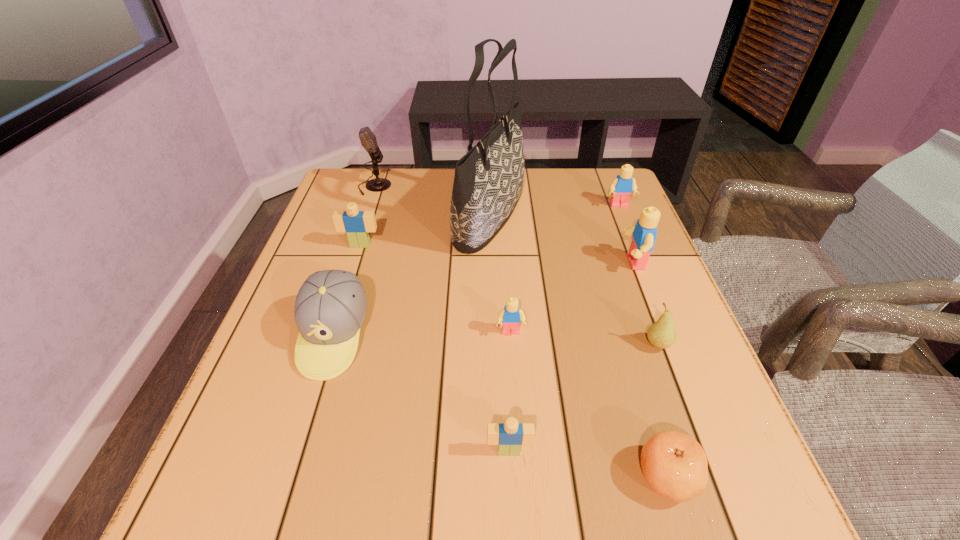
This screenshot has height=540, width=960. Identify the location of pear. (662, 334).

Where is `the nearest yellow Lego`? the nearest yellow Lego is located at coordinates (511, 316).

Image resolution: width=960 pixels, height=540 pixels. What are the coordinates of `the smallest yellow Lego` in the screenshot? It's located at (511, 316).

At what (x,y) coordinates should I click in order to perform the action: click on the right beige Lego. Please return your answer as a coordinate pair (x, y). The width and height of the screenshot is (960, 540). Looking at the image, I should click on (509, 436).

Where is `the smaller beige Lego`? This screenshot has width=960, height=540. the smaller beige Lego is located at coordinates (509, 436).

Where is `orange clementine`? orange clementine is located at coordinates (674, 465).

You are a GUI agent. You are given a task and a screenshot of the screen. Output one action in this format:
    pyautogui.click(x=<x>, y=<y>)
    Task: Click on the shortest object
    
    Given the screenshot: What is the action you would take?
    pyautogui.click(x=674, y=465)

Identify the location of vacant region located 0.330m on the front of the tallest object. (494, 374).

Locate an element on the screen. The width and height of the screenshot is (960, 540). vacant space located on the front-facing side of the microphone is located at coordinates (439, 187).

This screenshot has height=540, width=960. I want to click on vacant space located on the front-facing side of the second farthest yellow Lego, so click(575, 262).